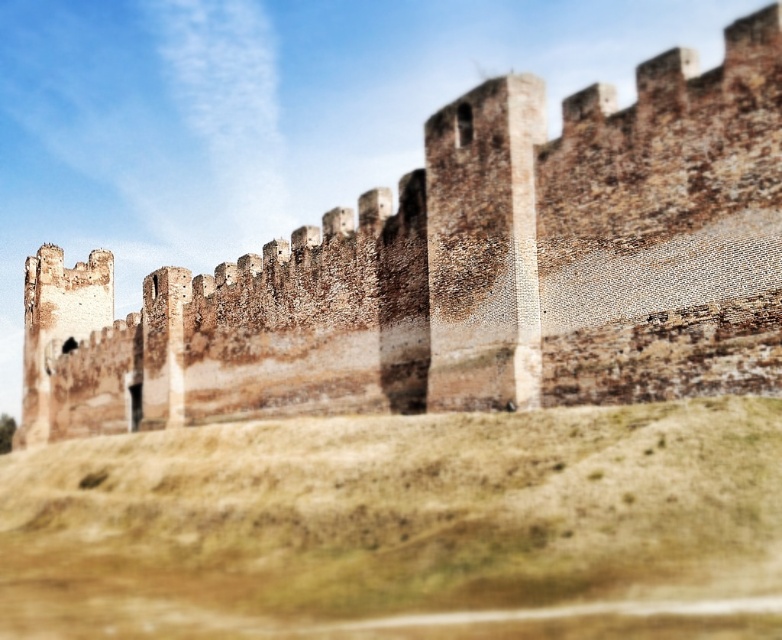
Question: Does brown stone wall at center appear under brown grassy hill at lower center?

Choices:
 (A) yes
 (B) no

Answer: (B)

Question: Does brown stone wall at center appear over brown grassy hill at lower center?

Choices:
 (A) yes
 (B) no

Answer: (A)

Question: Which object appears closest to the camera in this image?

Choices:
 (A) brown grassy hill at lower center
 (B) brown stone wall at center

Answer: (A)

Question: Is brown stone wall at center thinner than brown grassy hill at lower center?

Choices:
 (A) yes
 (B) no

Answer: (B)